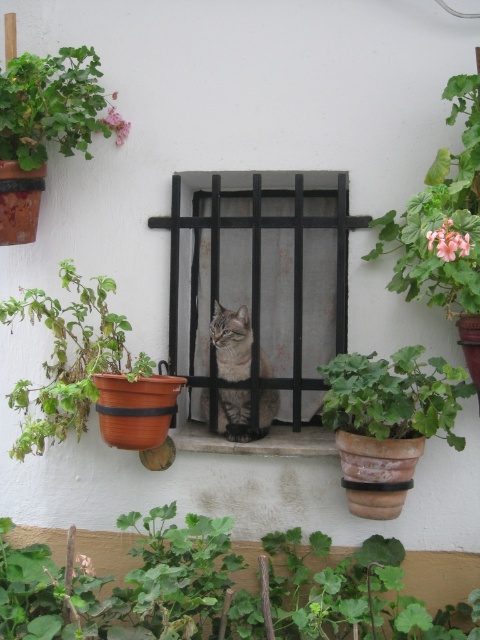
Is point (384, 365) positioned before point (0, 180)?

Yes, it is in front of point (0, 180).

The height and width of the screenshot is (640, 480). What do you see at coordinates (394, 396) in the screenshot? I see `green matte pot at right` at bounding box center [394, 396].

Where is `green matte pot at right`? This screenshot has width=480, height=640. green matte pot at right is located at coordinates (394, 396).

Who is more forward, [172,257] or [264,388]?

Point [172,257] is more forward.

Measure the distance between point (x=210, y=422) and camera.

They are 12.07 feet apart.

The height and width of the screenshot is (640, 480). In order to click on black metal bars at center in this screenshot , I will do `click(257, 291)`.

Is green matte pot at left further to camera compared to gray tabby cat at center?

No, green matte pot at left is in front of gray tabby cat at center.

Where is `green matte pot at left`? green matte pot at left is located at coordinates (69, 358).

Is point (130, 358) farther from camera compared to point (236, 419)?

That is False.

I want to click on green matte pot at left, so click(x=69, y=358).